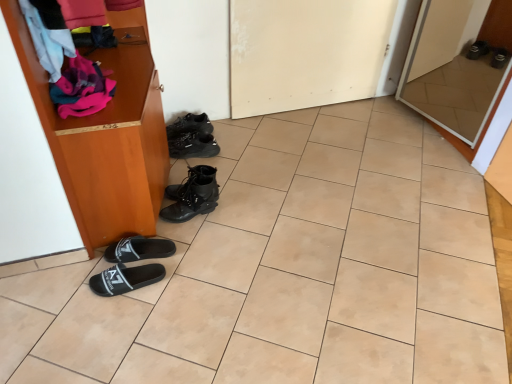
Locate an element on the screen. free region under black leather sneakers at center, the 4th footwear positioned from the bottom (from a real-world perspective) is located at coordinates (202, 148).